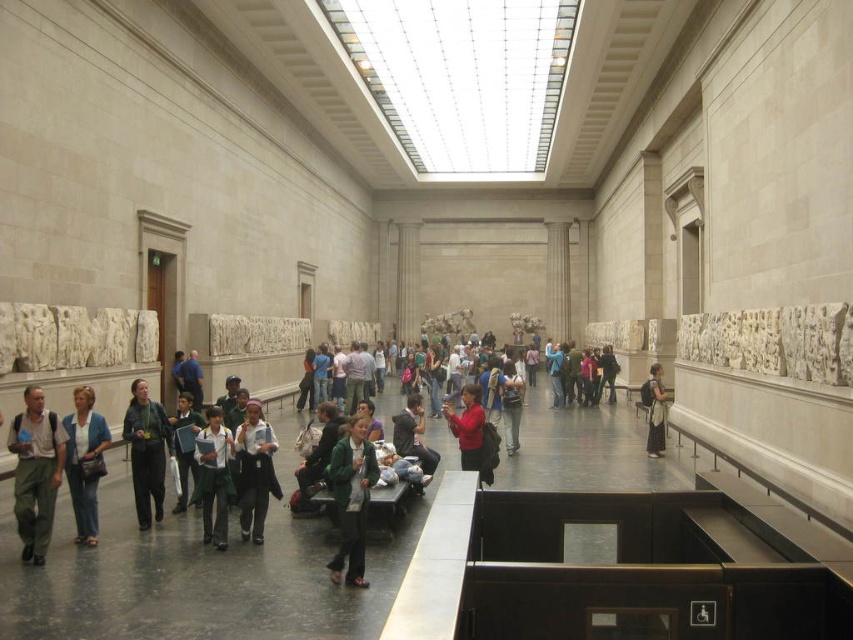
Question: From the image, what is the correct spatial relationship of denim jacket at lower left in relation to matte black backpack at center?

Choices:
 (A) right
 (B) left

Answer: (B)

Question: Among these points, which one is nearest to the camera?

Choices:
 (A) (660, 451)
 (B) (395, 435)

Answer: (B)

Question: Which point is farther to the camera?

Choices:
 (A) (654, 435)
 (B) (146, 404)
 (C) (370, 484)

Answer: (A)

Question: Which of the following is the closest to the observer?

Choices:
 (A) (148, 515)
 (B) (656, 451)
 (C) (245, 464)

Answer: (A)

Question: Can you confirm if dark gray backpack at center is positioned to the right of matte black backpack at center?

Choices:
 (A) no
 (B) yes

Answer: (A)

Question: Can you confirm if denim jacket at lower left is bigger than green uniform at center?

Choices:
 (A) yes
 (B) no

Answer: (B)